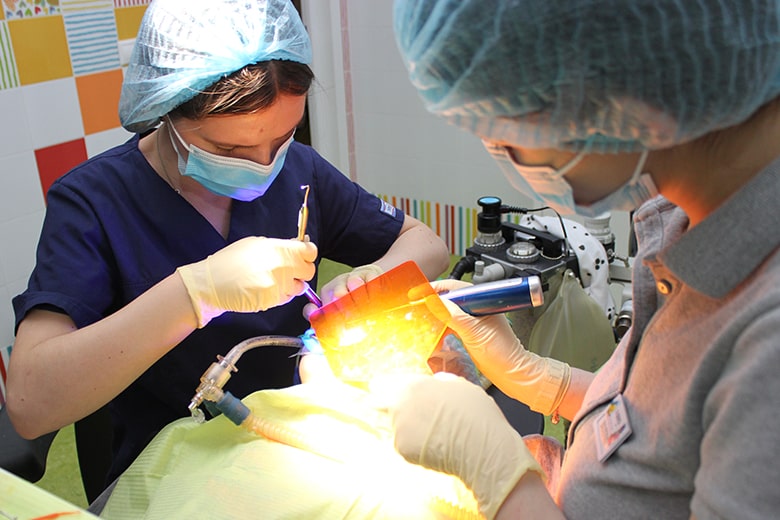
Where is `decorative solid squares on the wall`? The width and height of the screenshot is (780, 520). decorative solid squares on the wall is located at coordinates (41, 49), (93, 97), (66, 154).